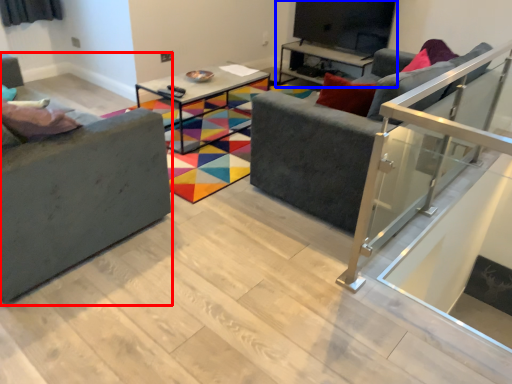
Question: Which object appears farthest to the camera in this image, studio couch (highlighted by a red box) or entertainment center (highlighted by a blue box)?

Choices:
 (A) studio couch
 (B) entertainment center

Answer: (B)